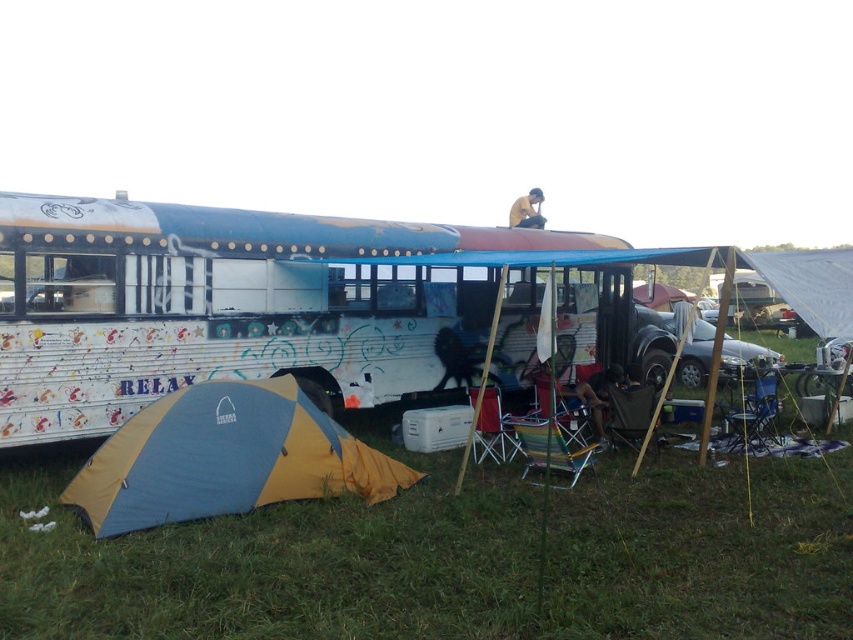
You are standing in the camping scene and want to reach the point marked at coordinates (339,440). The repurposed bus is between you and that point. Can you walk around the bus to reach it without going through the bus itself?

The point at coordinates (339,440) is 7.03 meters away from you. Since the repurposed bus is blocking your direct path, you can walk around it to reach the point as long as there is enough space around the bus to maneuver. However, the description does not provide information about the bus dimensions or the surrounding space, so it is uncertain if this is possible without additional details.

You are standing at the point marked by the coordinates point (225, 458). Based on the scene description, what object are you standing on?

The point (225, 458) indicates the yellow and blue fabric tent at lower left, so you are standing on the yellow and blue fabric tent at lower left.